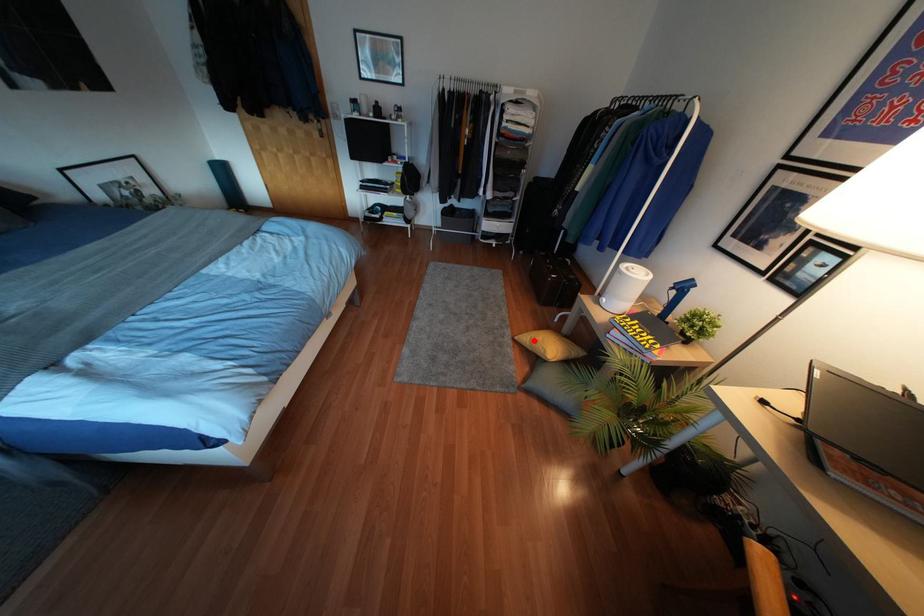
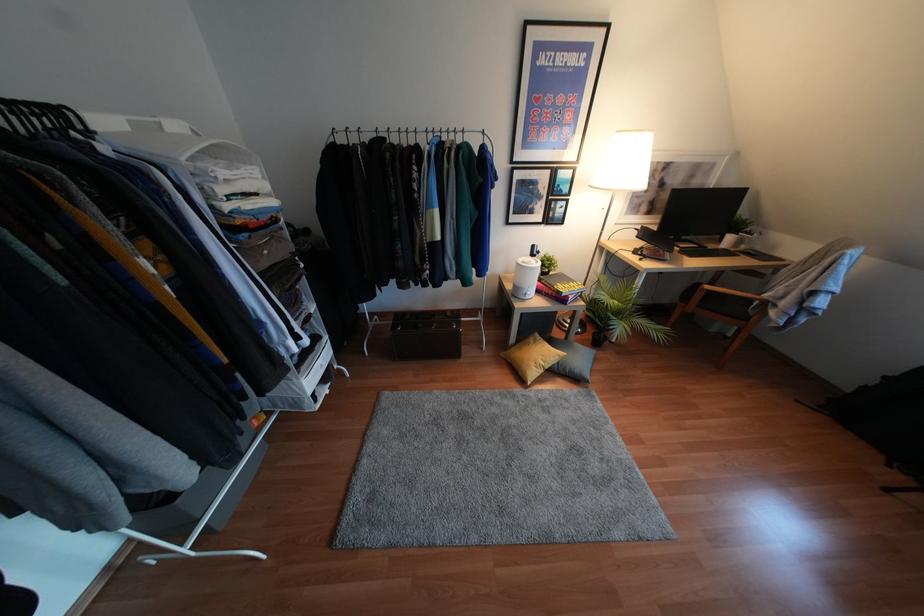
Question: I am providing you with two images of the same scene from different viewpoints. Given a red point in image1, look at the same physical point in image2. Is it:

Choices:
 (A) Closer to the viewpoint
 (B) Farther from the viewpoint

Answer: (B)